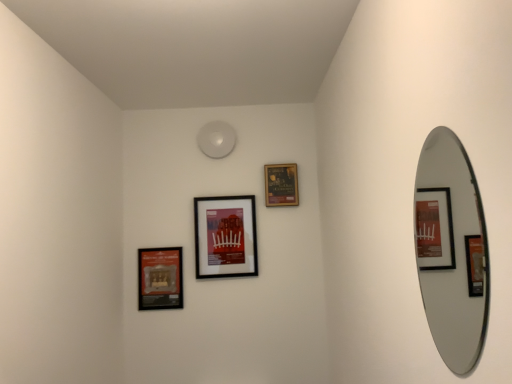
How much space does matte black picture frame at upper center, arranged as the 3th picture frame when viewed from the left, occupy vertically?

It is 9.26 inches.

Measure the distance between silver metallic mirror at right and camera.

silver metallic mirror at right and camera are 2.04 meters apart from each other.

Find the location of a particular element. The width and height of the screenshot is (512, 384). matte black picture frame at upper center, arranged as the 3th picture frame when viewed from the left is located at coordinates (281, 185).

Between matte black picture frame at center, the 2th picture frame when ordered from right to left, and matte black picture frame at upper center, arranged as the 3th picture frame when viewed from the left, which one has smaller width?

matte black picture frame at upper center, arranged as the 3th picture frame when viewed from the left.

Looking at this image, from a real-world perspective, which is physically above, matte black picture frame at center, the second picture frame positioned from the left, or matte black picture frame at upper center, arranged as the 3th picture frame when viewed from the left?

In real-world perspective, matte black picture frame at upper center, arranged as the 3th picture frame when viewed from the left, is above.

Is matte black picture frame at center, the 2th picture frame when ordered from right to left, looking in the opposite direction of matte black picture frame at upper center, arranged as the 1th picture frame when viewed from the right?

That's not correct — matte black picture frame at center, the 2th picture frame when ordered from right to left, is not looking away from matte black picture frame at upper center, arranged as the 1th picture frame when viewed from the right.

Is matte black picture frame at lower left, the 3th picture frame from the right, positioned with its back to matte black picture frame at center, the second picture frame positioned from the left?

No, matte black picture frame at lower left, the 3th picture frame from the right, is not facing the opposite direction of matte black picture frame at center, the second picture frame positioned from the left.

Based on the photo, from a real-world perspective, between matte black picture frame at lower left, which appears as the first picture frame when viewed from the left, and matte black picture frame at center, the second picture frame positioned from the left, who is vertically lower?

matte black picture frame at lower left, which appears as the first picture frame when viewed from the left, from a real-world perspective.

Considering the sizes of objects matte black picture frame at lower left, the 3th picture frame from the right, and matte black picture frame at center, the 2th picture frame when ordered from right to left, in the image provided, who is shorter, matte black picture frame at lower left, the 3th picture frame from the right, or matte black picture frame at center, the 2th picture frame when ordered from right to left,?

matte black picture frame at lower left, the 3th picture frame from the right.

Who is smaller, matte black picture frame at lower left, the 3th picture frame from the right, or matte black picture frame at center, the 2th picture frame when ordered from right to left?

With smaller size is matte black picture frame at lower left, the 3th picture frame from the right.

Can you tell me how much matte black picture frame at center, the second picture frame positioned from the left, and silver metallic mirror at right differ in facing direction?

They differ by 93 degrees in their facing directions.

Between point (228, 254) and point (480, 317), which one is positioned behind?

The point (228, 254) is farther from the camera.

Is matte black picture frame at center, the 2th picture frame when ordered from right to left, wider than silver metallic mirror at right?

Yes.

Does matte black picture frame at center, the second picture frame positioned from the left, have a lesser height compared to silver metallic mirror at right?

Yes.

Who is bigger, matte black picture frame at upper center, arranged as the 3th picture frame when viewed from the left, or silver metallic mirror at right?

With larger size is silver metallic mirror at right.

From a real-world perspective, who is located higher, matte black picture frame at upper center, arranged as the 3th picture frame when viewed from the left, or silver metallic mirror at right?

matte black picture frame at upper center, arranged as the 3th picture frame when viewed from the left.

Could you tell me if matte black picture frame at upper center, arranged as the 1th picture frame when viewed from the right, is facing silver metallic mirror at right?

Yes.

Locate an element on the screen. mirror that is in front of the matte black picture frame at upper center, arranged as the 1th picture frame when viewed from the right is located at coordinates (451, 250).

Can we say silver metallic mirror at right lies outside matte black picture frame at lower left, the 3th picture frame from the right?

Yes.

Is silver metallic mirror at right not close to matte black picture frame at lower left, the 3th picture frame from the right?

silver metallic mirror at right is far away from matte black picture frame at lower left, the 3th picture frame from the right.

How many degrees apart are the facing directions of silver metallic mirror at right and matte black picture frame at lower left, the 3th picture frame from the right?

90.7 degrees.

Looking at the image, does silver metallic mirror at right seem bigger or smaller compared to matte black picture frame at lower left, the 3th picture frame from the right?

In the image, silver metallic mirror at right appears to be larger than matte black picture frame at lower left, the 3th picture frame from the right.

Is point (291, 189) positioned after point (175, 289)?

Yes, point (291, 189) is behind point (175, 289).

Could you tell me if matte black picture frame at upper center, arranged as the 1th picture frame when viewed from the right, is turned towards matte black picture frame at lower left, which appears as the first picture frame when viewed from the left?

No, matte black picture frame at upper center, arranged as the 1th picture frame when viewed from the right, does not turn towards matte black picture frame at lower left, which appears as the first picture frame when viewed from the left.

Is point (449, 144) positioned before point (295, 174)?

Yes, point (449, 144) is in front of point (295, 174).

Which object is further away from the camera taking this photo, silver metallic mirror at right or matte black picture frame at upper center, arranged as the 3th picture frame when viewed from the left?

matte black picture frame at upper center, arranged as the 3th picture frame when viewed from the left, is further away from the camera.

From the image's perspective, is silver metallic mirror at right located beneath matte black picture frame at upper center, arranged as the 1th picture frame when viewed from the right?

Yes, from the image's perspective, silver metallic mirror at right is below matte black picture frame at upper center, arranged as the 1th picture frame when viewed from the right.

Considering the sizes of objects silver metallic mirror at right and matte black picture frame at upper center, arranged as the 3th picture frame when viewed from the left, in the image provided, who is shorter, silver metallic mirror at right or matte black picture frame at upper center, arranged as the 3th picture frame when viewed from the left,?

Standing shorter between the two is matte black picture frame at upper center, arranged as the 3th picture frame when viewed from the left.

From a real-world perspective, which picture frame is the 1st one underneath the matte black picture frame at upper center, arranged as the 3th picture frame when viewed from the left? Please provide its 2D coordinates.

[(225, 237)]

I want to click on the 1st picture frame above the matte black picture frame at lower left, which appears as the first picture frame when viewed from the left (from the image's perspective), so click(225, 237).

From the image, which object appears to be nearer to matte black picture frame at lower left, which appears as the first picture frame when viewed from the left, matte black picture frame at upper center, arranged as the 1th picture frame when viewed from the right, or silver metallic mirror at right?

matte black picture frame at upper center, arranged as the 1th picture frame when viewed from the right, lies closer to matte black picture frame at lower left, which appears as the first picture frame when viewed from the left, than the other object.

From the image, which object appears to be farther from matte black picture frame at lower left, the 3th picture frame from the right, silver metallic mirror at right or matte black picture frame at upper center, arranged as the 3th picture frame when viewed from the left?

Among the two, silver metallic mirror at right is located further to matte black picture frame at lower left, the 3th picture frame from the right.

Estimate the real-world distances between objects in this image. Which object is further from matte black picture frame at upper center, arranged as the 3th picture frame when viewed from the left, silver metallic mirror at right or matte black picture frame at center, the second picture frame positioned from the left?

The object further to matte black picture frame at upper center, arranged as the 3th picture frame when viewed from the left, is silver metallic mirror at right.

From the image, which object appears to be nearer to matte black picture frame at lower left, which appears as the first picture frame when viewed from the left, silver metallic mirror at right or matte black picture frame at center, the 2th picture frame when ordered from right to left?

matte black picture frame at center, the 2th picture frame when ordered from right to left.

Which object lies nearer to the anchor point silver metallic mirror at right, matte black picture frame at upper center, arranged as the 1th picture frame when viewed from the right, or matte black picture frame at lower left, the 3th picture frame from the right?

Among the two, matte black picture frame at upper center, arranged as the 1th picture frame when viewed from the right, is located nearer to silver metallic mirror at right.

From the image, which object appears to be nearer to silver metallic mirror at right, matte black picture frame at center, the second picture frame positioned from the left, or matte black picture frame at lower left, the 3th picture frame from the right?

matte black picture frame at center, the second picture frame positioned from the left.

Estimate the real-world distances between objects in this image. Which object is further from silver metallic mirror at right, matte black picture frame at upper center, arranged as the 3th picture frame when viewed from the left, or matte black picture frame at center, the 2th picture frame when ordered from right to left?

Based on the image, matte black picture frame at center, the 2th picture frame when ordered from right to left, appears to be further to silver metallic mirror at right.

From the image, which object appears to be farther from matte black picture frame at upper center, arranged as the 1th picture frame when viewed from the right, matte black picture frame at center, the second picture frame positioned from the left, or matte black picture frame at lower left, which appears as the first picture frame when viewed from the left?

Among the two, matte black picture frame at lower left, which appears as the first picture frame when viewed from the left, is located further to matte black picture frame at upper center, arranged as the 1th picture frame when viewed from the right.

This screenshot has width=512, height=384. Identify the location of picture frame between silver metallic mirror at right and matte black picture frame at lower left, the 3th picture frame from the right, in the front-back direction. (225, 237).

Where is `picture frame located between matte black picture frame at lower left, the 3th picture frame from the right, and matte black picture frame at upper center, arranged as the 1th picture frame when viewed from the right, in the left-right direction`? picture frame located between matte black picture frame at lower left, the 3th picture frame from the right, and matte black picture frame at upper center, arranged as the 1th picture frame when viewed from the right, in the left-right direction is located at coordinates (225, 237).